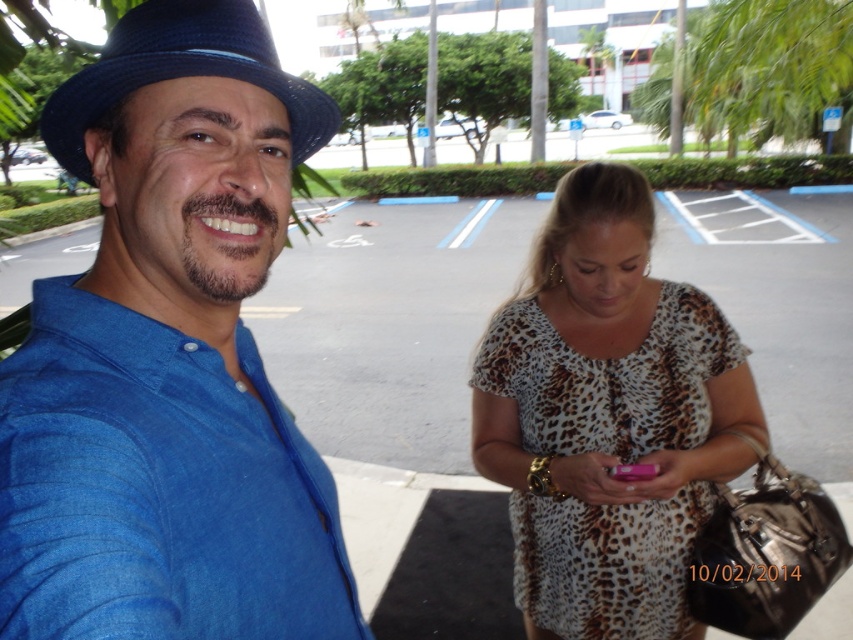
Is the position of leopard print fabric dress at center more distant than that of blue fabric fedora at upper left?

Yes, leopard print fabric dress at center is further from the viewer.

Is leopard print fabric dress at center bigger than blue fabric fedora at upper left?

Yes, leopard print fabric dress at center is bigger than blue fabric fedora at upper left.

Which is behind, point (596, 576) or point (202, 40)?

Point (596, 576)

Where is `leopard print fabric dress at center`? This screenshot has height=640, width=853. leopard print fabric dress at center is located at coordinates (608, 378).

Does blue linen shirt at left have a greater width compared to leopard print fabric dress at center?

No, blue linen shirt at left is not wider than leopard print fabric dress at center.

Is blue linen shirt at left to the right of leopard print fabric dress at center from the viewer's perspective?

Incorrect, blue linen shirt at left is not on the right side of leopard print fabric dress at center.

Between point (241, 340) and point (601, 624), which one is positioned in front?

Positioned in front is point (241, 340).

Identify the location of blue linen shirt at left. The width and height of the screenshot is (853, 640). (169, 358).

Can you confirm if blue linen shirt at left is wider than blue fabric fedora at upper left?

In fact, blue linen shirt at left might be narrower than blue fabric fedora at upper left.

Is point (204, 563) in front of point (86, 77)?

Yes, it is.

Is point (30, 584) less distant than point (48, 97)?

Yes, point (30, 584) is closer to viewer.

In order to click on blue linen shirt at left in this screenshot , I will do `click(169, 358)`.